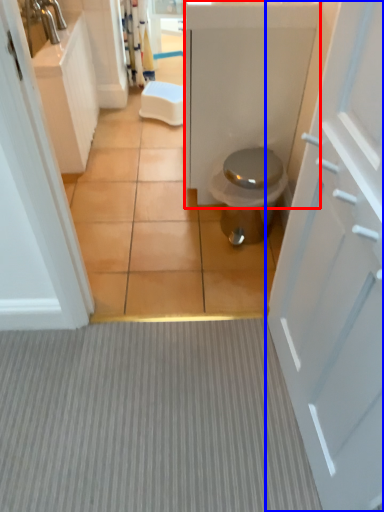
Question: Which object appears closest to the camera in this image, bath (highlighted by a red box) or door (highlighted by a blue box)?

Choices:
 (A) bath
 (B) door

Answer: (B)